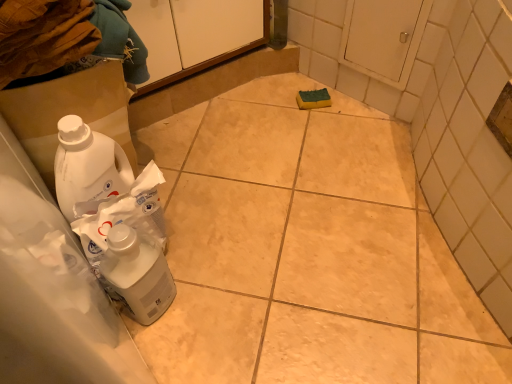
Describe the element at coordinates (137, 275) in the screenshot. I see `white glossy plastic bottle at lower left` at that location.

Find the location of `white matte cabinet at upper center`. white matte cabinet at upper center is located at coordinates (195, 34).

I want to click on white glossy plastic bottle at lower left, so click(x=137, y=275).

Is white matte cabinet at upper center aimed at white cardboard box at lower left?

No, white matte cabinet at upper center does not turn towards white cardboard box at lower left.

From the image's perspective, is white matte cabinet at upper center below white cardboard box at lower left?

Incorrect, from the image's perspective, white matte cabinet at upper center is higher than white cardboard box at lower left.

Between point (147, 15) and point (54, 90), which one is positioned behind?

Point (147, 15)

Considering the sizes of white matte cabinet at upper center and white cardboard box at lower left in the image, is white matte cabinet at upper center bigger or smaller than white cardboard box at lower left?

In the image, white matte cabinet at upper center appears to be larger than white cardboard box at lower left.

Does white cardboard box at lower left have a greater height compared to white glossy plastic bottle at lower left?

Correct, white cardboard box at lower left is much taller as white glossy plastic bottle at lower left.

From the image's perspective, between white cardboard box at lower left and white glossy plastic bottle at lower left, who is located below?

white glossy plastic bottle at lower left appears lower in the image.

Between white cardboard box at lower left and white glossy plastic bottle at lower left, which one is positioned in front?

Positioned in front is white glossy plastic bottle at lower left.

Is white matte cabinet at upper center inside white cardboard box at lower left?

No.

From the image's perspective, is white cardboard box at lower left located above or below white matte cabinet at upper center?

Based on their image positions, white cardboard box at lower left is located beneath white matte cabinet at upper center.

Find the location of a particular element. The height and width of the screenshot is (384, 512). cardboard box below the white matte cabinet at upper center (from the image's perspective) is located at coordinates (69, 112).

Considering the relative sizes of white cardboard box at lower left and white matte cabinet at upper center in the image provided, is white cardboard box at lower left thinner than white matte cabinet at upper center?

Correct, the width of white cardboard box at lower left is less than that of white matte cabinet at upper center.

Would you say white glossy plastic bottle at lower left is to the left or to the right of white matte cabinet at upper center in the picture?

white glossy plastic bottle at lower left is positioned on white matte cabinet at upper center's right side.

Image resolution: width=512 pixels, height=384 pixels. Identify the location of cleaning product on the right of the white matte cabinet at upper center. (137, 275).

Is there a large distance between white glossy plastic bottle at lower left and white matte cabinet at upper center?

white glossy plastic bottle at lower left is near white matte cabinet at upper center, not far away.

From the image's perspective, is white glossy plastic bottle at lower left positioned above or below white matte cabinet at upper center?

Clearly, from the image's perspective, white glossy plastic bottle at lower left is below white matte cabinet at upper center.

Which of these two, white matte cabinet at upper center or white glossy plastic bottle at lower left, is bigger?

white matte cabinet at upper center.

Between white matte cabinet at upper center and white glossy plastic bottle at lower left, which one has smaller width?

white glossy plastic bottle at lower left is thinner.

Between white matte cabinet at upper center and white glossy plastic bottle at lower left, which one is positioned in front?

white glossy plastic bottle at lower left is closer to the camera.

Which is correct: white matte cabinet at upper center is inside white glossy plastic bottle at lower left, or outside of it?

white matte cabinet at upper center cannot be found inside white glossy plastic bottle at lower left.

This screenshot has width=512, height=384. Identify the location of cleaning product located in front of the white cardboard box at lower left. (137, 275).

Is white glossy plastic bottle at lower left at the left side of white cardboard box at lower left?

Incorrect, white glossy plastic bottle at lower left is not on the left side of white cardboard box at lower left.

Based on the photo, from the image's perspective, is white glossy plastic bottle at lower left located above white cardboard box at lower left?

No, from the image's perspective, white glossy plastic bottle at lower left is not on top of white cardboard box at lower left.

Locate an element on the screen. The width and height of the screenshot is (512, 384). cardboard box below the white matte cabinet at upper center (from the image's perspective) is located at coordinates (69, 112).

You are a GUI agent. You are given a task and a screenshot of the screen. Output one action in this format:
    pyautogui.click(x=<x>, y=<y>)
    Task: Click on the cardboard box that is above the white glossy plastic bottle at lower left (from a real-world perspective)
    
    Given the screenshot: What is the action you would take?
    pyautogui.click(x=69, y=112)

Estimate the real-world distances between objects in this image. Which object is further from white matte cabinet at upper center, white cardboard box at lower left or white glossy plastic bottle at lower left?

white glossy plastic bottle at lower left.

When comparing their distances from white glossy plastic bottle at lower left, does white cardboard box at lower left or white matte cabinet at upper center seem closer?

white cardboard box at lower left is closer to white glossy plastic bottle at lower left.

Estimate the real-world distances between objects in this image. Which object is closer to white cardboard box at lower left, white matte cabinet at upper center or white glossy plastic bottle at lower left?

Based on the image, white glossy plastic bottle at lower left appears to be nearer to white cardboard box at lower left.

Considering their positions, is white glossy plastic bottle at lower left positioned further to white matte cabinet at upper center than white cardboard box at lower left?

white glossy plastic bottle at lower left lies further to white matte cabinet at upper center than the other object.

Based on their spatial positions, is white glossy plastic bottle at lower left or white matte cabinet at upper center further from white cardboard box at lower left?

white matte cabinet at upper center.

When comparing their distances from white glossy plastic bottle at lower left, does white matte cabinet at upper center or white cardboard box at lower left seem closer?

white cardboard box at lower left is closer to white glossy plastic bottle at lower left.

What are the coordinates of `cardboard box between white matte cabinet at upper center and white glossy plastic bottle at lower left from top to bottom` in the screenshot? It's located at (69, 112).